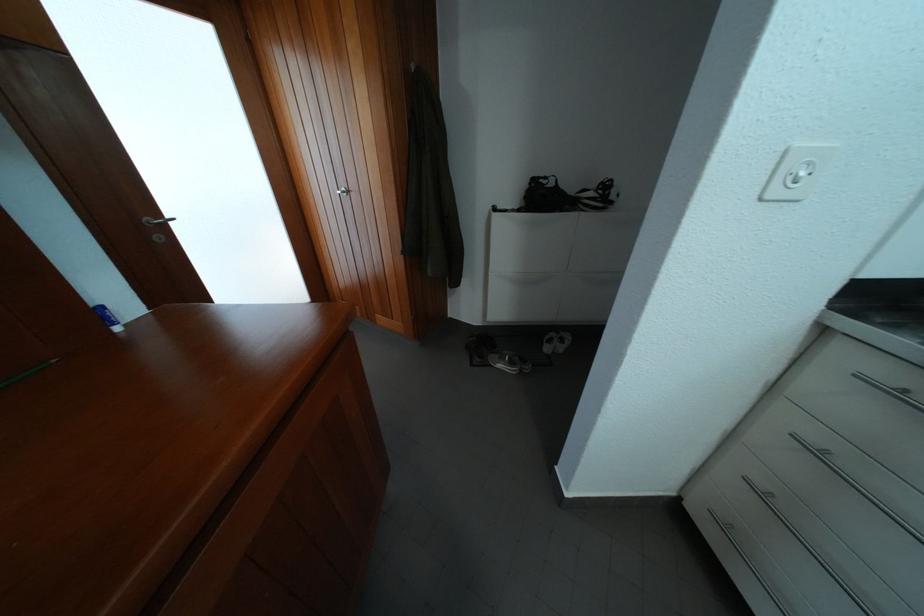
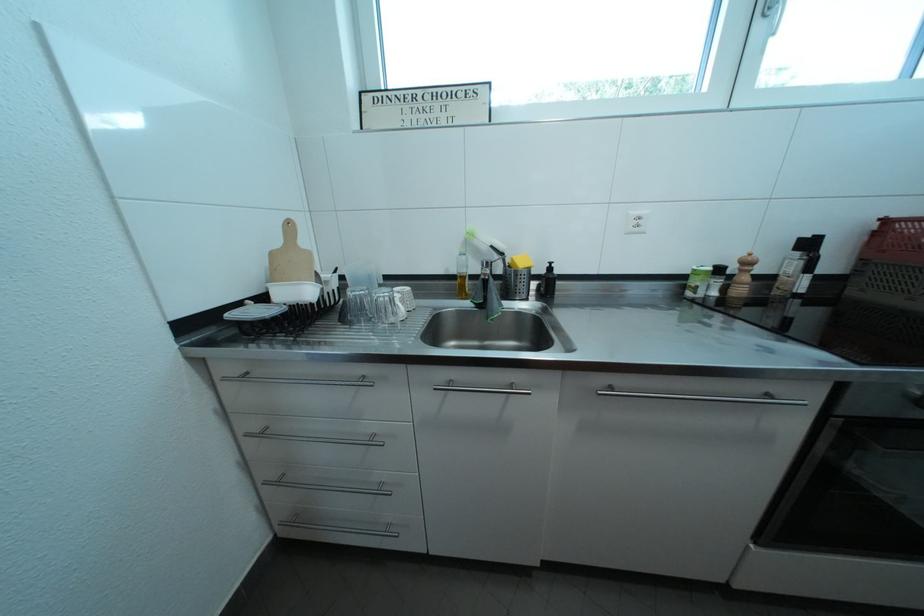
Question: Based on the continuous images, in which direction is the camera rotating? Reply with the corresponding letter.

Choices:
 (A) Left
 (B) Right
 (C) Up
 (D) Down

Answer: (B)